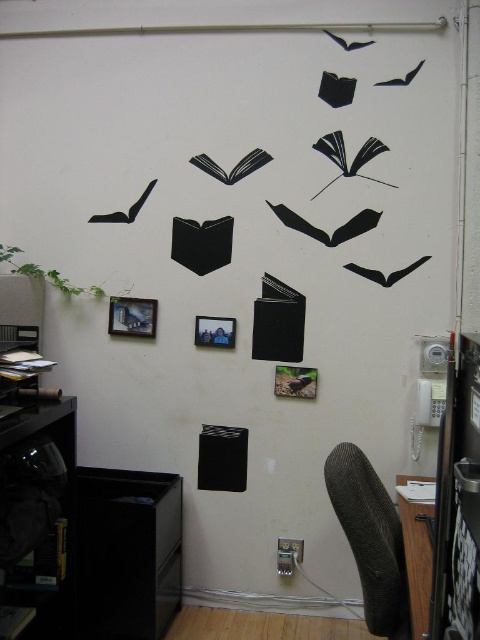
Question: Which object is farther from the camera taking this photo?

Choices:
 (A) metallic silver picture frame at upper left
 (B) matte black book at left

Answer: (A)

Question: Can you confirm if black matte bookshelf at lower left is positioned below wooden table at lower right?

Choices:
 (A) yes
 (B) no

Answer: (B)

Question: Is wooden table at lower right positioned behind matte black book at left?

Choices:
 (A) yes
 (B) no

Answer: (B)

Question: Does metallic silver picture frame at upper left appear under matte black book at left?

Choices:
 (A) no
 (B) yes

Answer: (A)

Question: Estimate the real-world distances between objects in this image. Which object is farther from the textured gray chair at lower right?

Choices:
 (A) black matte bookshelf at lower left
 (B) metallic silver picture frame at center
 (C) hardcover book at lower left
 (D) matte black book at left

Answer: (D)

Question: Which point is farther to the camera?

Choices:
 (A) metallic silver picture frame at upper left
 (B) black matte bookshelf at lower left

Answer: (A)